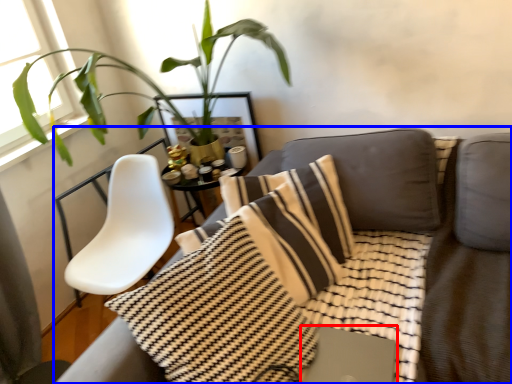
Question: Which of the following is the closest to the observer, computer (highlighted by a red box) or studio couch (highlighted by a blue box)?

Choices:
 (A) computer
 (B) studio couch

Answer: (B)